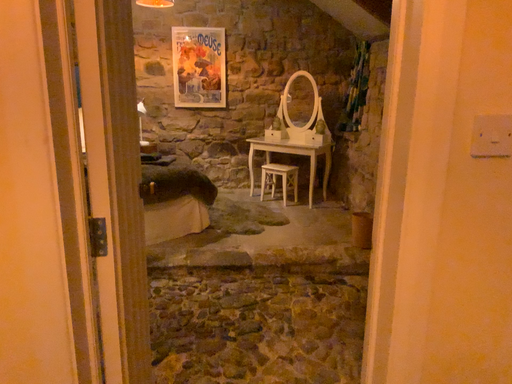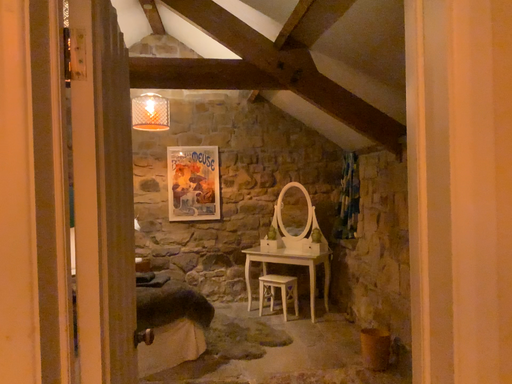
Question: Which way did the camera rotate in the video?

Choices:
 (A) rotated upward
 (B) rotated downward

Answer: (A)